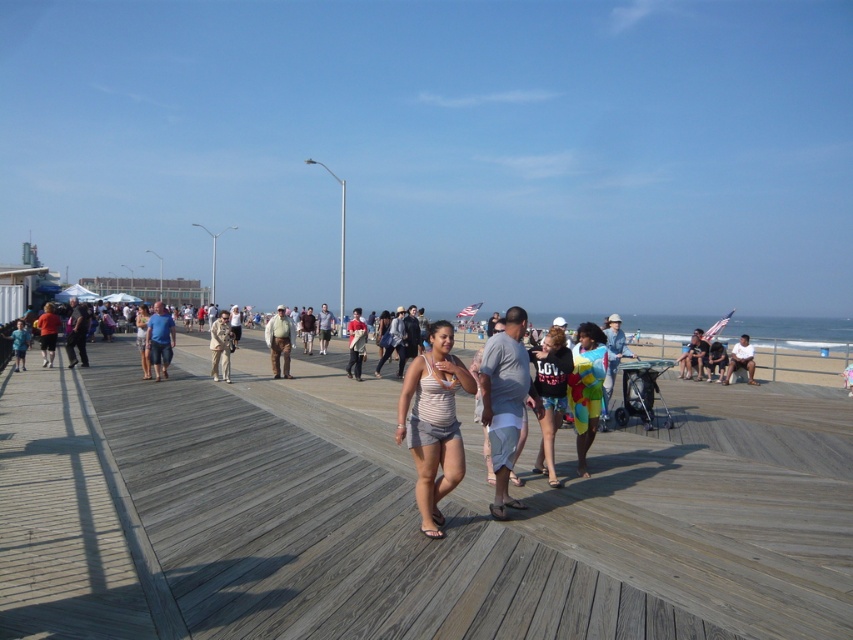
Which is behind, point (560, 355) or point (357, 332)?

Positioned behind is point (357, 332).

Is matte black sweatshirt at center shorter than red cotton shirt at center?

Correct, matte black sweatshirt at center is not as tall as red cotton shirt at center.

This screenshot has width=853, height=640. Describe the element at coordinates (550, 394) in the screenshot. I see `matte black sweatshirt at center` at that location.

Find the location of a particular element. The width and height of the screenshot is (853, 640). matte black sweatshirt at center is located at coordinates tap(550, 394).

Is brown leather pants at center to the right of light beige uniform at center from the viewer's perspective?

Indeed, brown leather pants at center is positioned on the right side of light beige uniform at center.

Looking at this image, between brown leather pants at center and light beige uniform at center, which one is positioned higher?

brown leather pants at center is above.

Between point (276, 333) and point (218, 348), which one is positioned behind?

Positioned behind is point (276, 333).

Find the location of a particular element. The image size is (853, 640). brown leather pants at center is located at coordinates pos(279,340).

Who is higher up, multicolored fabric dress at center or light brown leather jacket at center?

light brown leather jacket at center is higher up.

Does multicolored fabric dress at center come in front of light brown leather jacket at center?

Yes, multicolored fabric dress at center is closer to the viewer.

This screenshot has height=640, width=853. Describe the element at coordinates (585, 388) in the screenshot. I see `multicolored fabric dress at center` at that location.

I want to click on multicolored fabric dress at center, so click(x=585, y=388).